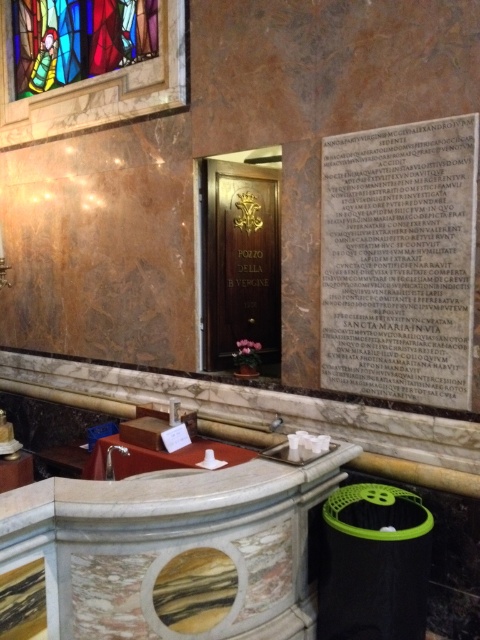
Does black stone plaque at center have a lesser width compared to stained glass window at upper left?

Yes, black stone plaque at center is thinner than stained glass window at upper left.

Is black stone plaque at center smaller than stained glass window at upper left?

Indeed, black stone plaque at center has a smaller size compared to stained glass window at upper left.

Which is in front, point (334, 218) or point (87, 60)?

Point (334, 218) is in front.

Locate an element on the screen. This screenshot has height=640, width=480. black stone plaque at center is located at coordinates (399, 260).